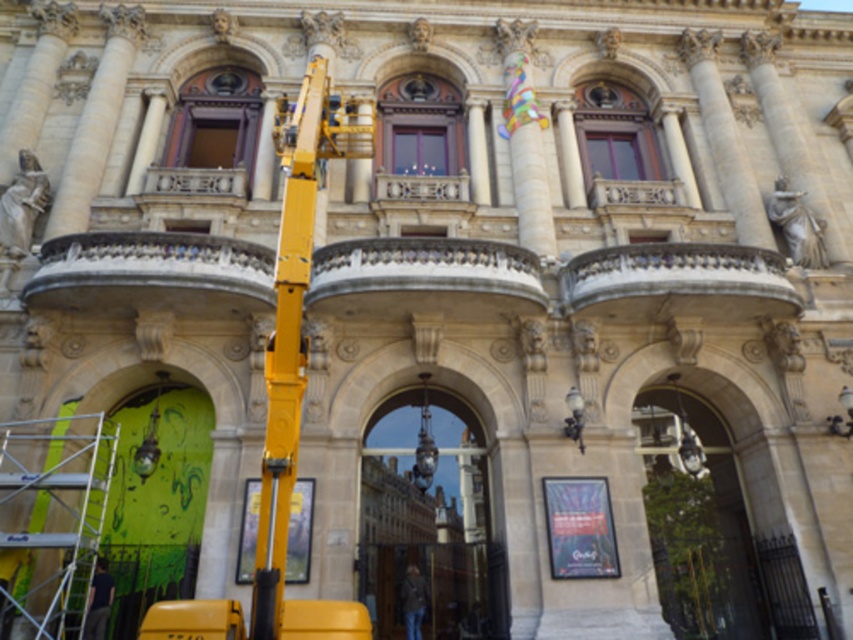
You are a construction worker who needs to move a heavy beam from the yellow metallic crane at left to the silver metallic scaffolding at lower left. The beam is 12 meters long. Can you safely transport it without the beam touching the ground?

The distance between the yellow metallic crane at left and the silver metallic scaffolding at lower left is 11.56 meters. Since the beam is 12 meters long, it would extend beyond the distance between them, so the beam would touch the ground. Therefore, you cannot safely transport it without the beam touching the ground.

You are a construction worker standing at the base of the building and see the silver metallic scaffolding at lower left and the dark blue jeans at lower left. Which object is taller?

The silver metallic scaffolding at lower left is taller than dark blue jeans at lower left.